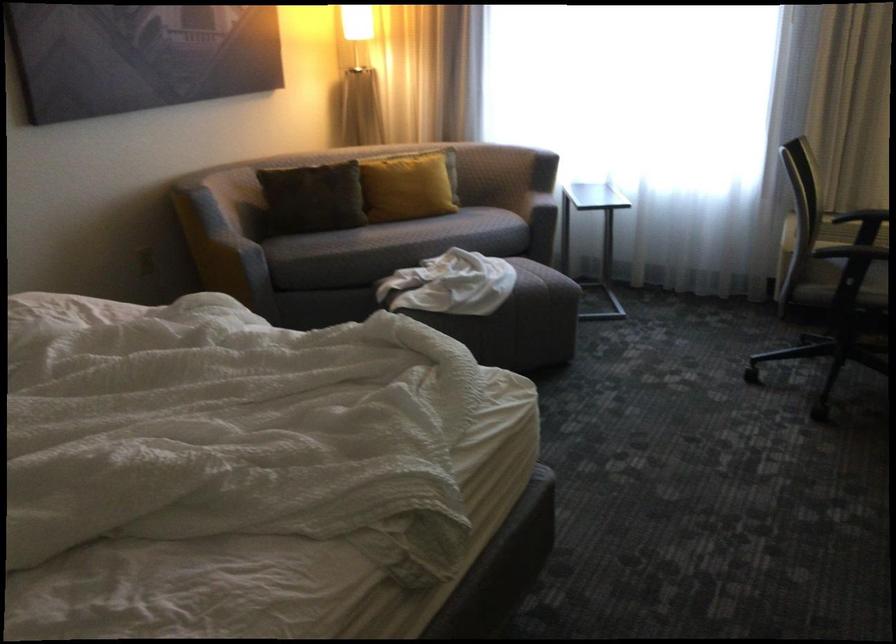
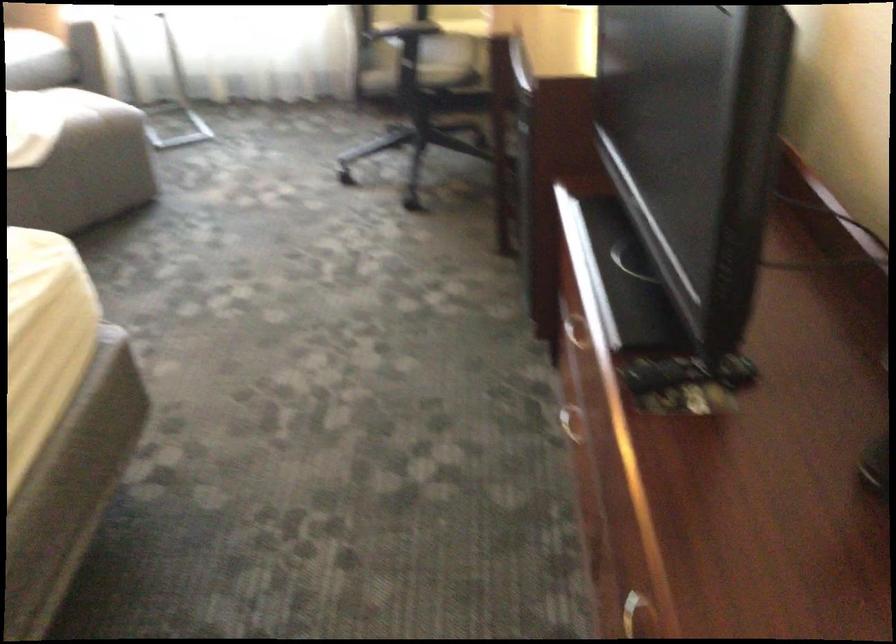
What movement of the cameraman would produce the second image?

The cameraman walked toward right, forward.